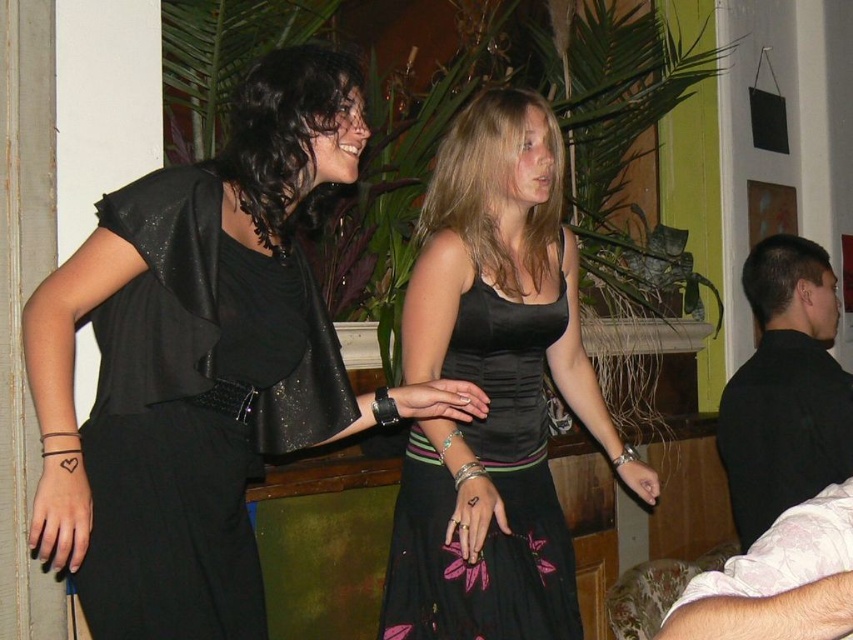
Who is positioned more to the left, black smooth shirt at right or light pink floral shirt at lower right?

light pink floral shirt at lower right

Is point (764, 316) positioned behind point (798, 572)?

Yes, point (764, 316) is farther from viewer.

Does point (811, 474) come closer to viewer compared to point (828, 602)?

No.

Locate an element on the screen. black smooth shirt at right is located at coordinates [785, 388].

Measure the distance between black textured dress at center and camera.

black textured dress at center is 1.78 meters away from camera.

Does black textured dress at center have a larger size compared to black smooth shirt at right?

No.

Does point (469, 353) come behind point (813, 464)?

No, (469, 353) is closer to viewer.

This screenshot has height=640, width=853. What are the coordinates of `black textured dress at center` in the screenshot? It's located at (495, 490).

Who is more distant from viewer, (181,400) or (413,586)?

Point (413,586)

Locate an element on the screen. The width and height of the screenshot is (853, 640). black leather dress at left is located at coordinates (190, 419).